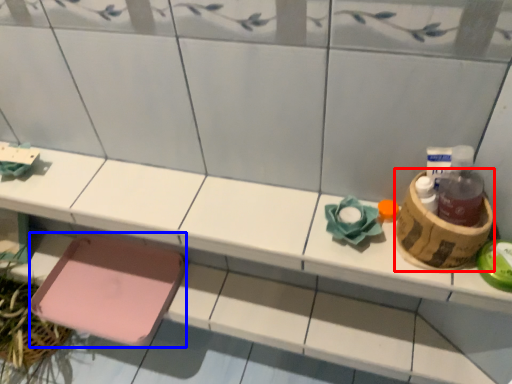
Question: Which object is further to the camera taking this photo, basket (highlighted by a red box) or step stool (highlighted by a blue box)?

Choices:
 (A) basket
 (B) step stool

Answer: (B)